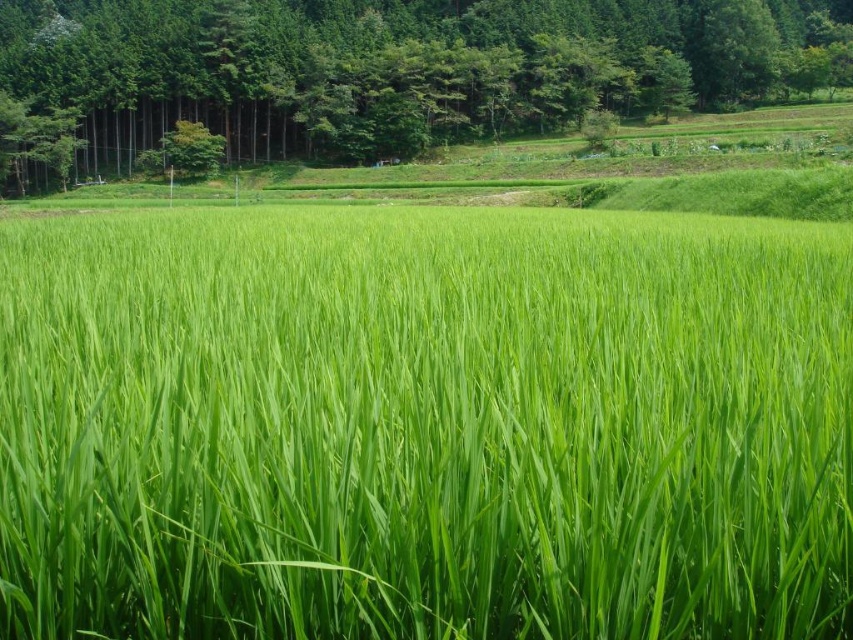
Question: Among these objects, which one is farthest from the camera?

Choices:
 (A) green leafy tree at upper center
 (B) green grassy field at center

Answer: (A)

Question: Is green grassy field at center smaller than green leafy tree at upper center?

Choices:
 (A) yes
 (B) no

Answer: (A)

Question: Is green grassy field at center wider than green leafy tree at upper center?

Choices:
 (A) no
 (B) yes

Answer: (A)

Question: Which point is farther from the camera taking this photo?

Choices:
 (A) (227, 4)
 (B) (834, 406)

Answer: (A)

Question: Observing the image, what is the correct spatial positioning of green grassy field at center in reference to green leafy tree at upper center?

Choices:
 (A) above
 (B) below

Answer: (B)